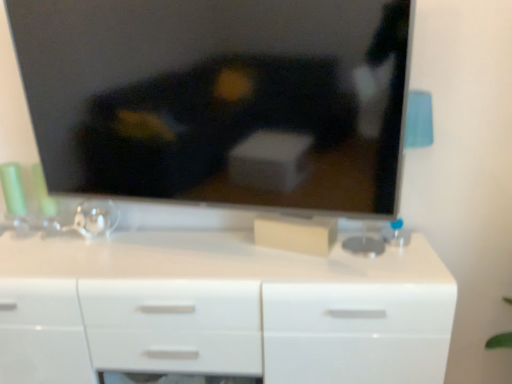
Question: Is white glossy chest of drawers at center positioned with its back to matte black tv at upper center?

Choices:
 (A) no
 (B) yes

Answer: (A)

Question: Can you confirm if white glossy chest of drawers at center is thinner than matte black tv at upper center?

Choices:
 (A) no
 (B) yes

Answer: (A)

Question: Does white glossy chest of drawers at center have a lesser height compared to matte black tv at upper center?

Choices:
 (A) yes
 (B) no

Answer: (B)

Question: Can you confirm if white glossy chest of drawers at center is positioned to the left of matte black tv at upper center?

Choices:
 (A) yes
 (B) no

Answer: (A)

Question: From the image's perspective, is white glossy chest of drawers at center under matte black tv at upper center?

Choices:
 (A) no
 (B) yes

Answer: (B)

Question: Is white glossy chest of drawers at center positioned before matte black tv at upper center?

Choices:
 (A) no
 (B) yes

Answer: (A)

Question: Would you say white glossy chest of drawers at center is part of matte black tv at upper center's contents?

Choices:
 (A) yes
 (B) no

Answer: (B)

Question: Is matte black tv at upper center positioned with its back to white glossy chest of drawers at center?

Choices:
 (A) no
 (B) yes

Answer: (A)

Question: Is matte black tv at upper center next to white glossy chest of drawers at center and touching it?

Choices:
 (A) yes
 (B) no

Answer: (B)

Question: Does matte black tv at upper center have a lesser height compared to white glossy chest of drawers at center?

Choices:
 (A) yes
 (B) no

Answer: (A)

Question: Is matte black tv at upper center located outside white glossy chest of drawers at center?

Choices:
 (A) yes
 (B) no

Answer: (A)

Question: Does matte black tv at upper center appear on the left side of white glossy chest of drawers at center?

Choices:
 (A) yes
 (B) no

Answer: (B)

Question: Is point (434, 362) closer or farther from the camera than point (240, 67)?

Choices:
 (A) farther
 (B) closer

Answer: (A)